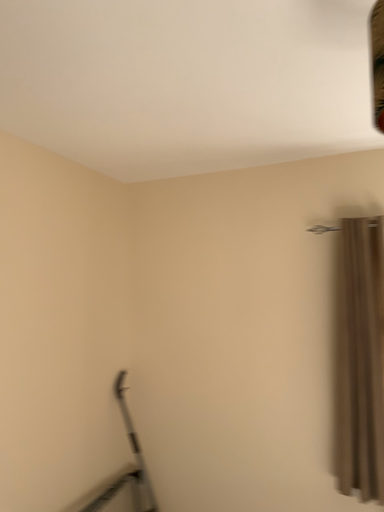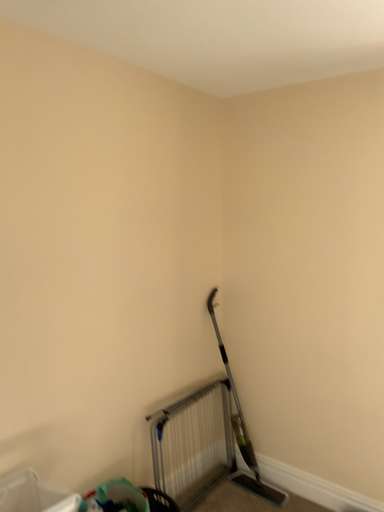
Question: How did the camera likely rotate when shooting the video?

Choices:
 (A) rotated downward
 (B) rotated upward

Answer: (A)